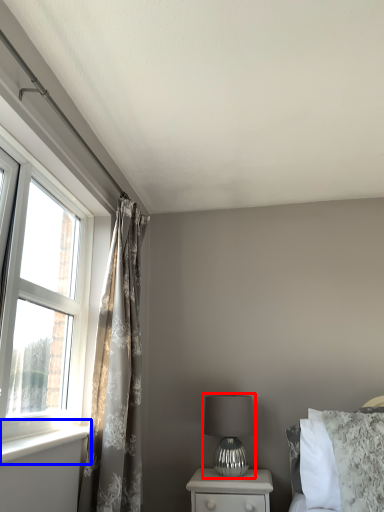
Question: Which of the following is the farthest to the observer, table lamp (highlighted by a red box) or window sill (highlighted by a blue box)?

Choices:
 (A) table lamp
 (B) window sill

Answer: (A)